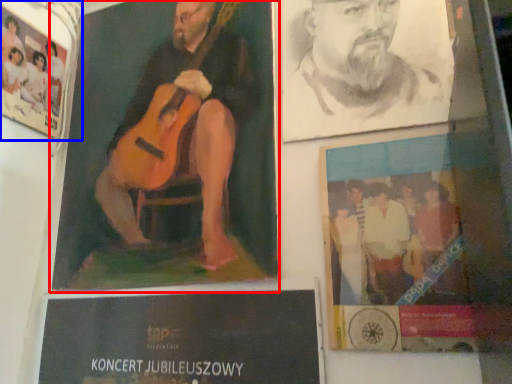
Question: Which object is closer to the camera taking this photo, poster (highlighted by a red box) or poster (highlighted by a blue box)?

Choices:
 (A) poster
 (B) poster

Answer: (A)